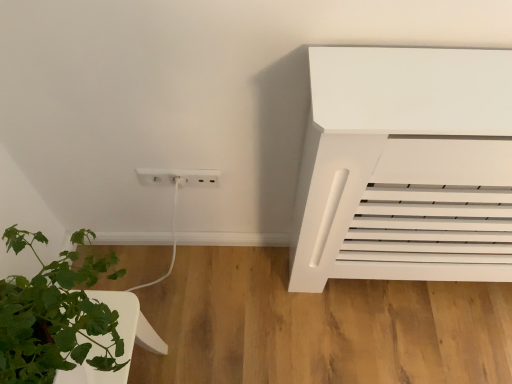
Question: Is white plastic outlet at lower center inside the boundaries of green leafy plant at lower left, or outside?

Choices:
 (A) inside
 (B) outside

Answer: (B)

Question: From the image's perspective, is white plastic outlet at lower center positioned above or below green leafy plant at lower left?

Choices:
 (A) below
 (B) above

Answer: (B)

Question: In the image, is white plastic outlet at lower center positioned in front of or behind green leafy plant at lower left?

Choices:
 (A) front
 (B) behind

Answer: (B)

Question: From the image's perspective, is green leafy plant at lower left located above or below white plastic outlet at lower center?

Choices:
 (A) above
 (B) below

Answer: (B)

Question: Looking at their shapes, would you say green leafy plant at lower left is wider or thinner than white plastic outlet at lower center?

Choices:
 (A) wide
 (B) thin

Answer: (A)

Question: Is point [x=60, y=331] closer or farther from the camera than point [x=174, y=172]?

Choices:
 (A) farther
 (B) closer

Answer: (B)

Question: Visually, is green leafy plant at lower left positioned to the left or to the right of white plastic outlet at lower center?

Choices:
 (A) left
 (B) right

Answer: (A)